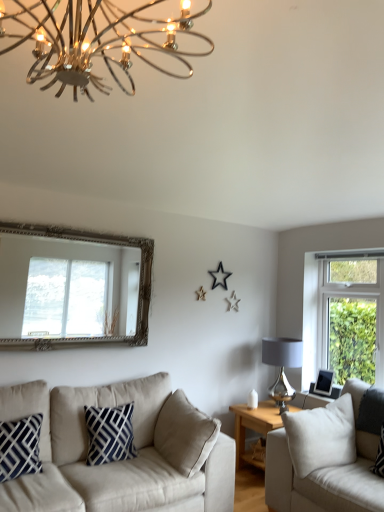
Question: From a real-world perspective, is matte gray glass lampshade at right, marked as the second lamp in a left-to-right arrangement, under white fabric couch at right, positioned as the 2th studio couch in left-to-right order?

Choices:
 (A) no
 (B) yes

Answer: (A)

Question: Can you confirm if matte gray glass lampshade at right, the first lamp positioned from the bottom, is thinner than white fabric couch at right, which is counted as the first studio couch, starting from the right?

Choices:
 (A) no
 (B) yes

Answer: (B)

Question: Is matte gray glass lampshade at right, which appears as the 2th lamp when viewed from the front, taller than white fabric couch at right, which is counted as the first studio couch, starting from the right?

Choices:
 (A) yes
 (B) no

Answer: (B)

Question: Could you tell me if matte gray glass lampshade at right, which appears as the 2th lamp when viewed from the front, is turned towards white fabric couch at right, which is counted as the first studio couch, starting from the right?

Choices:
 (A) no
 (B) yes

Answer: (B)

Question: Does matte gray glass lampshade at right, the first lamp positioned from the bottom, have a lesser height compared to white fabric couch at right, positioned as the 2th studio couch in left-to-right order?

Choices:
 (A) yes
 (B) no

Answer: (A)

Question: Does matte gray glass lampshade at right, the first lamp when ordered from back to front, have a smaller size compared to white fabric couch at right, positioned as the 2th studio couch in left-to-right order?

Choices:
 (A) no
 (B) yes

Answer: (B)

Question: Is black plastic picture frame at right looking in the opposite direction of silver ornate mirror at upper left?

Choices:
 (A) yes
 (B) no

Answer: (B)

Question: Does black plastic picture frame at right have a smaller size compared to silver ornate mirror at upper left?

Choices:
 (A) yes
 (B) no

Answer: (A)

Question: Is black plastic picture frame at right shorter than silver ornate mirror at upper left?

Choices:
 (A) no
 (B) yes

Answer: (B)

Question: Could silver ornate mirror at upper left be considered to be inside black plastic picture frame at right?

Choices:
 (A) yes
 (B) no

Answer: (B)

Question: From the image's perspective, is black plastic picture frame at right on top of silver ornate mirror at upper left?

Choices:
 (A) yes
 (B) no

Answer: (B)

Question: From the image's perspective, is black plastic picture frame at right under silver ornate mirror at upper left?

Choices:
 (A) yes
 (B) no

Answer: (A)

Question: Is black plastic picture frame at right positioned with its back to wooden side table at center?

Choices:
 (A) yes
 (B) no

Answer: (B)